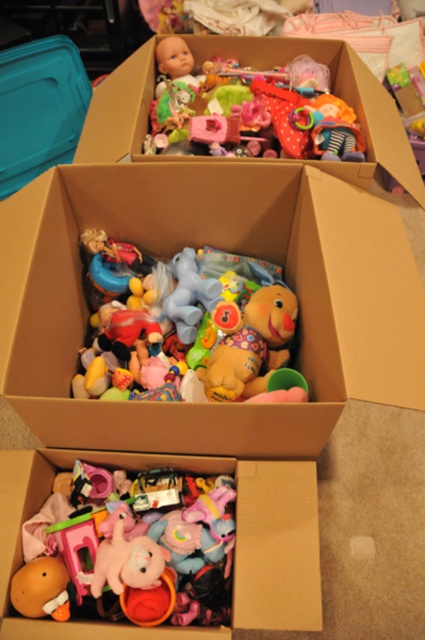
Question: Is multicolored plush toys at upper center to the left of matte plastic doll at upper center from the viewer's perspective?

Choices:
 (A) no
 (B) yes

Answer: (B)

Question: Considering the real-world distances, which object is closest to the soft plush toy at lower center?

Choices:
 (A) soft plush duck at center
 (B) multicolored plush toys at upper center
 (C) matte plastic doll at upper center

Answer: (A)

Question: Which point is closer to the camera taking this photo?

Choices:
 (A) (108, 506)
 (B) (271, 124)
 (C) (218, 372)

Answer: (A)

Question: Is soft plush duck at center closer to the viewer compared to matte plastic doll at upper center?

Choices:
 (A) yes
 (B) no

Answer: (A)

Question: Estimate the real-world distances between objects in this image. Which object is farther from the soft plush toy at lower center?

Choices:
 (A) matte plastic doll at upper center
 (B) multicolored plush toys at upper center

Answer: (A)

Question: Is soft plush duck at center in front of matte plastic doll at upper center?

Choices:
 (A) no
 (B) yes

Answer: (B)